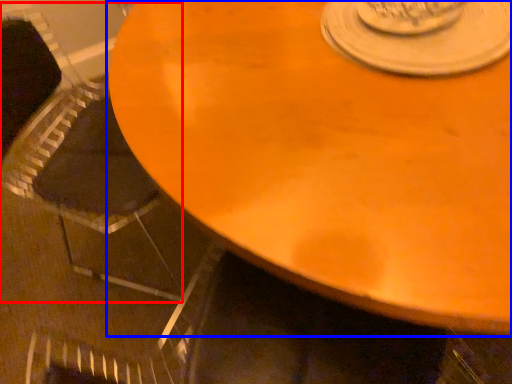
Question: Which object is further to the camera taking this photo, armchair (highlighted by a red box) or table (highlighted by a blue box)?

Choices:
 (A) armchair
 (B) table

Answer: (A)